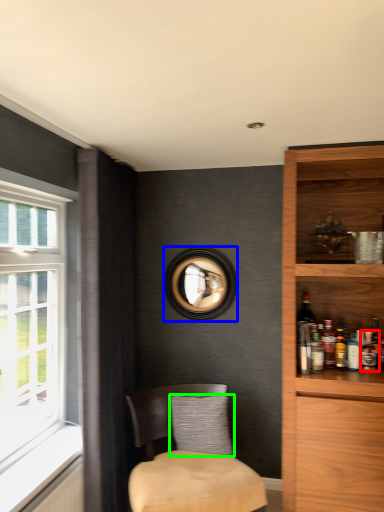
Question: Based on their relative distances, which object is nearer to beverage (highlighted by a red box)? Choose from picture frame (highlighted by a blue box) and pillow (highlighted by a green box).

Choices:
 (A) picture frame
 (B) pillow

Answer: (B)